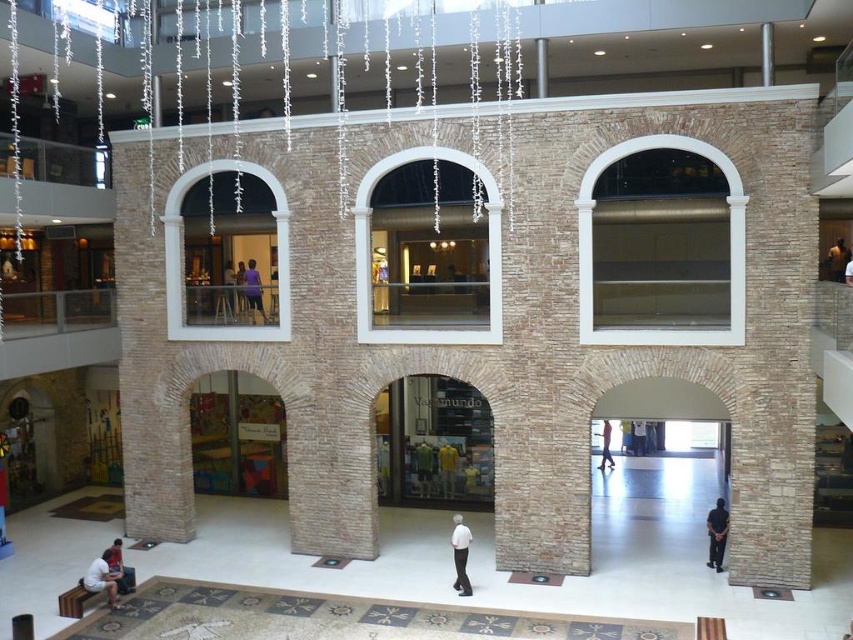
Can you confirm if marble mosaic floor at lower center is wider than dark brown leather jacket at upper right?

Yes, marble mosaic floor at lower center is wider than dark brown leather jacket at upper right.

Which of these two, marble mosaic floor at lower center or dark brown leather jacket at upper right, stands taller?

Standing taller between the two is dark brown leather jacket at upper right.

Which is in front, point (239, 627) or point (839, 250)?

Point (239, 627) is more forward.

The width and height of the screenshot is (853, 640). I want to click on marble mosaic floor at lower center, so click(334, 618).

Identify the location of light brown leather jacket at lower left. (120, 568).

I want to click on light brown leather jacket at lower left, so click(120, 568).

Locate an element on the screen. light brown leather jacket at lower left is located at coordinates point(120,568).

Is point (465, 554) closer to viewer compared to point (602, 428)?

Yes.

Is white matte shirt at center bigger than light brown leather jacket at center?

No, white matte shirt at center is not bigger than light brown leather jacket at center.

Locate an element on the screen. The height and width of the screenshot is (640, 853). white matte shirt at center is located at coordinates (460, 554).